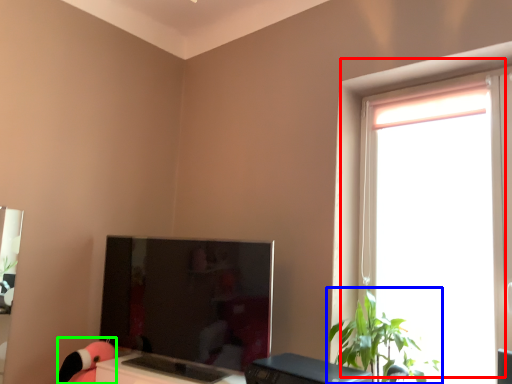
Question: Based on their relative distances, which object is farther from window (highlighted by a red box)? Choose from houseplant (highlighted by a blue box) and toy (highlighted by a green box).

Choices:
 (A) houseplant
 (B) toy

Answer: (B)